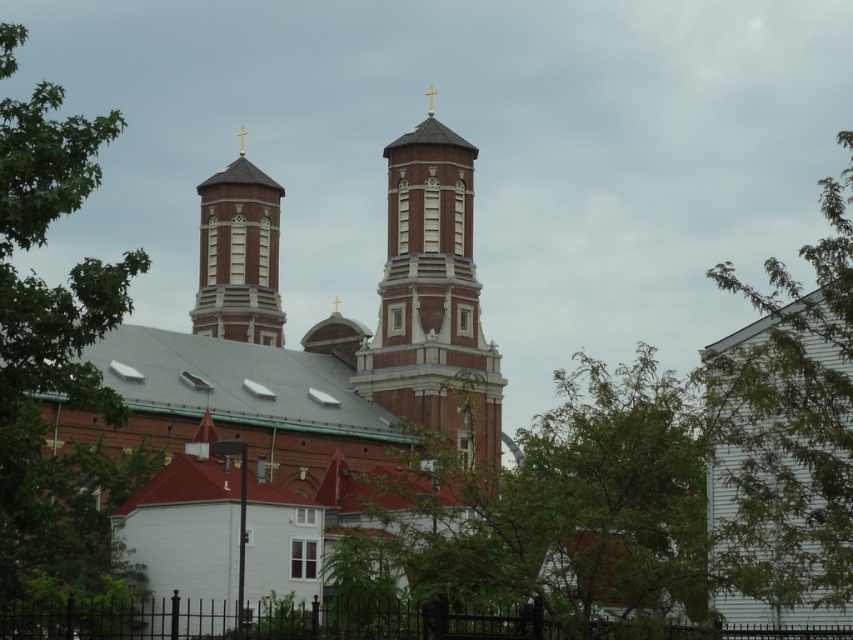
Who is higher up, green leafy tree at left or brick steeple at center?

green leafy tree at left

Which is below, green leafy tree at left or brick steeple at center?

brick steeple at center

The image size is (853, 640). What do you see at coordinates (51, 348) in the screenshot? I see `green leafy tree at left` at bounding box center [51, 348].

In order to click on green leafy tree at left in this screenshot , I will do `click(51, 348)`.

Is point (393, 284) less distant than point (242, 312)?

Yes, point (393, 284) is closer to viewer.

Who is positioned more to the left, brick steeple at center or matte brick tower at upper left?

From the viewer's perspective, matte brick tower at upper left appears more on the left side.

Does point (495, 355) lie behind point (273, 188)?

That is False.

At what (x,y) coordinates should I click in order to perform the action: click on brick steeple at center. Please return your answer as a coordinate pair (x, y). Image resolution: width=853 pixels, height=640 pixels. Looking at the image, I should click on (433, 301).

Who is positioned more to the right, brick church at center or green leafy tree at right?

green leafy tree at right

Is brick church at center thinner than green leafy tree at right?

Correct, brick church at center's width is less than green leafy tree at right's.

Which is behind, point (457, 323) or point (724, 365)?

The point (457, 323) is more distant.

Where is `brick church at center`? brick church at center is located at coordinates (323, 342).